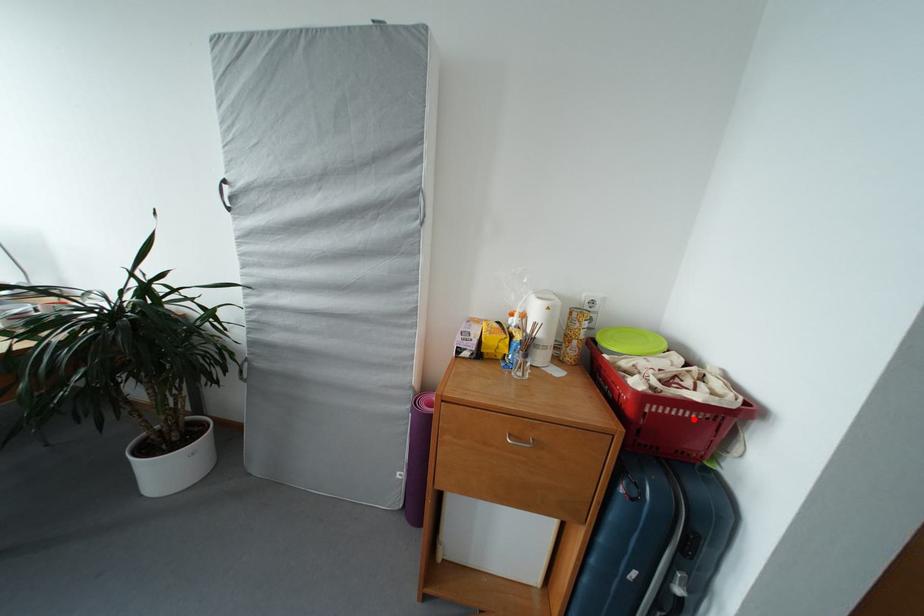
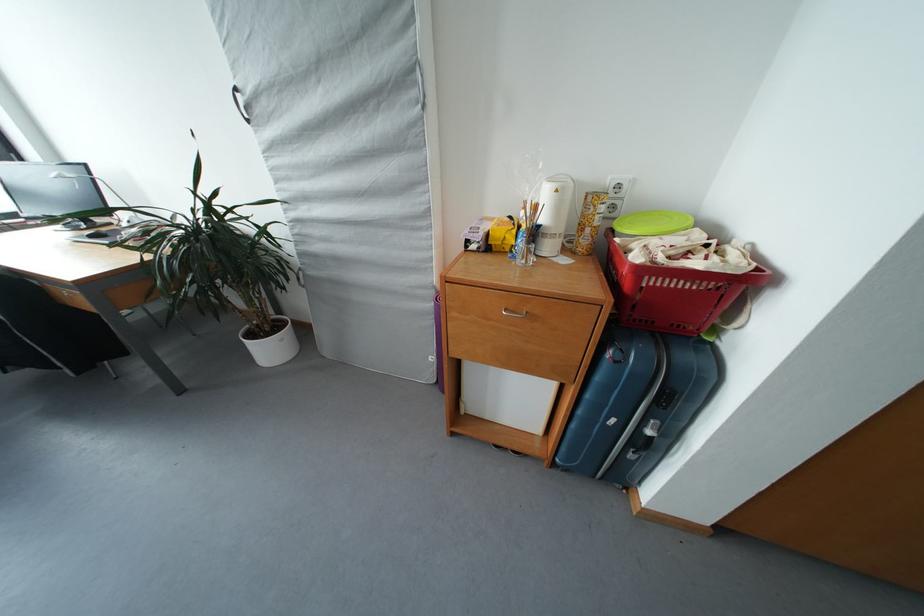
Locate, in the second image, the point that corresponds to the highlighted location in the first image.

(694, 291)